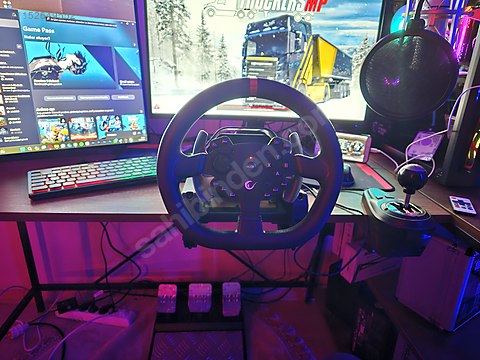
Where is `black fan`? This screenshot has width=480, height=360. black fan is located at coordinates (420, 83).